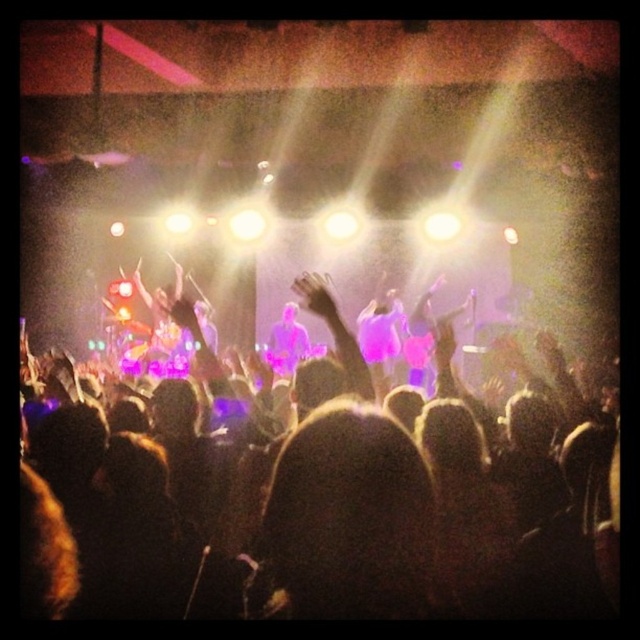
Does silhouette of person at center appear under dark hair at center?

Actually, silhouette of person at center is above dark hair at center.

Who is shorter, silhouette of person at center or dark hair at center?

dark hair at center is shorter.

Is point (433, 515) farther from viewer compared to point (292, 481)?

Yes.

Locate an element on the screen. Image resolution: width=640 pixels, height=640 pixels. silhouette of person at center is located at coordinates (333, 513).